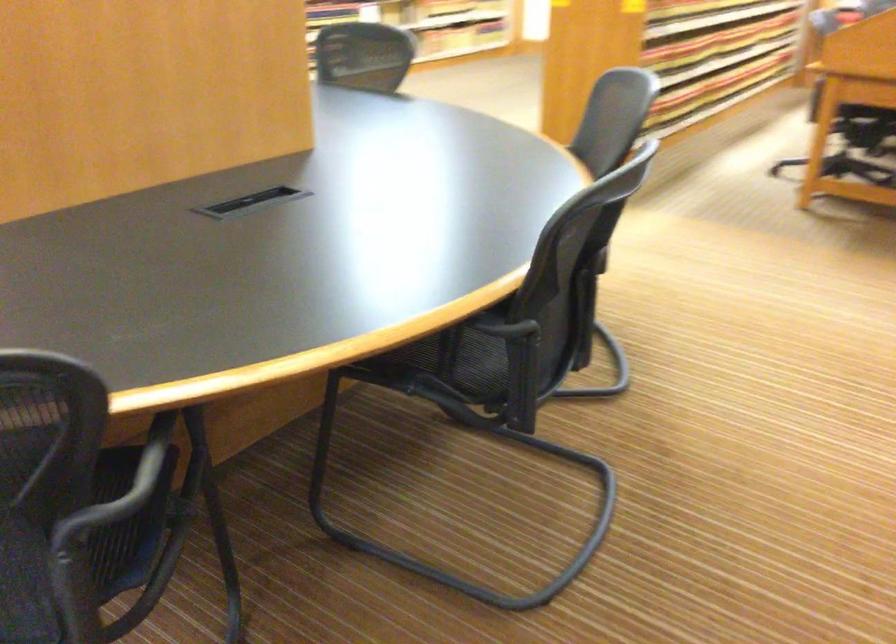
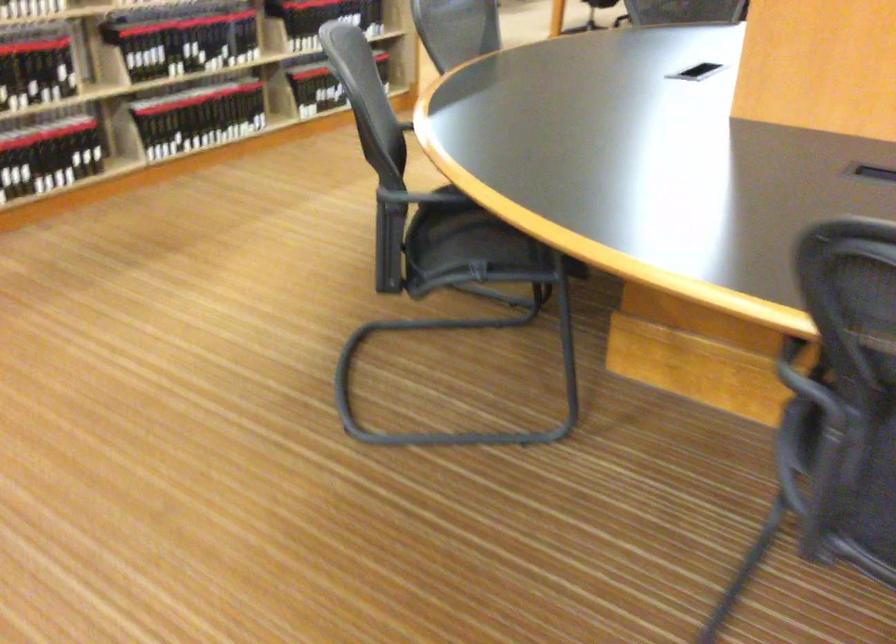
Question: In a continuous first-person perspective shot, in which direction is the camera moving?

Choices:
 (A) Left
 (B) Right
 (C) Forward
 (D) Backward

Answer: (A)